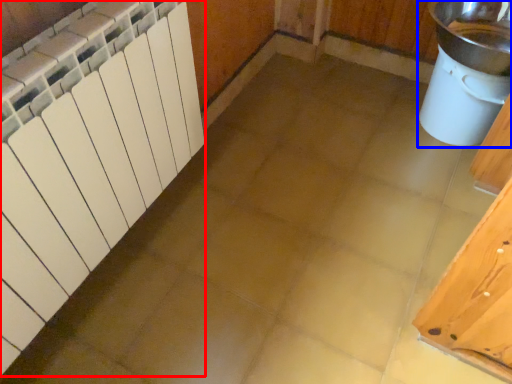
Question: Which of the following is the closest to the observer, radiator (highlighted by a red box) or sink (highlighted by a blue box)?

Choices:
 (A) radiator
 (B) sink

Answer: (A)